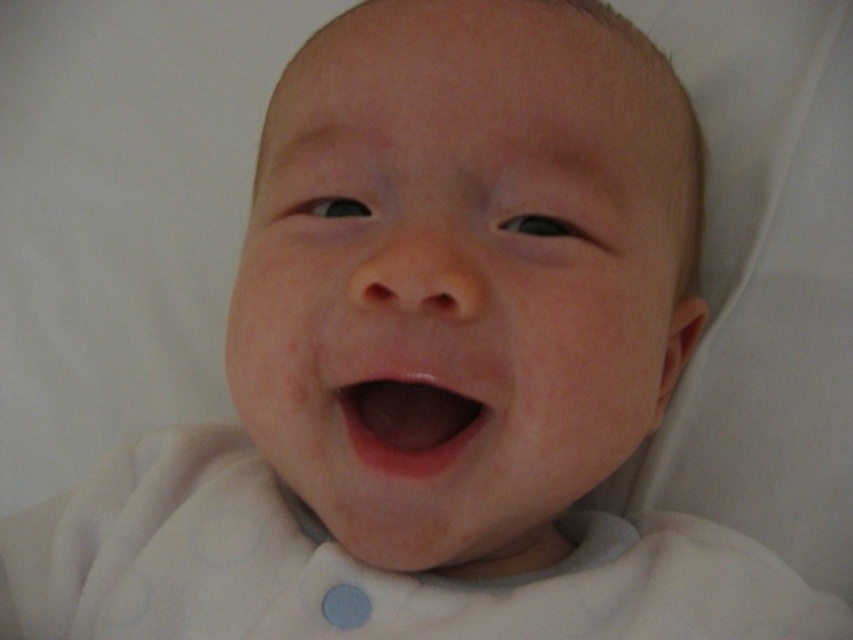
Does smooth skin baby at center appear under pink smooth flesh at center?

No.

Who is higher up, smooth skin baby at center or pink smooth flesh at center?

smooth skin baby at center is above.

Which is in front, point (280, 444) or point (467, 408)?

Positioned in front is point (280, 444).

Identify the location of smooth skin baby at center. Image resolution: width=853 pixels, height=640 pixels. (463, 273).